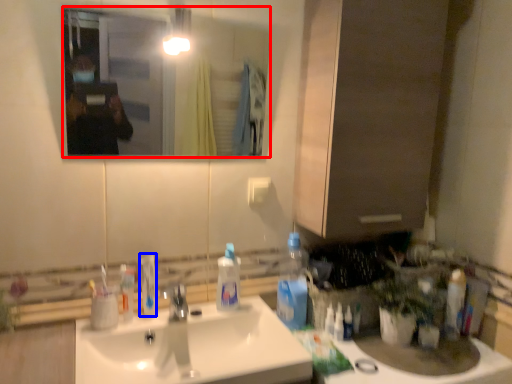
Question: Which point is closer to the camera, mirror (highlighted by a red box) or toothpaste (highlighted by a blue box)?

Choices:
 (A) mirror
 (B) toothpaste

Answer: (A)